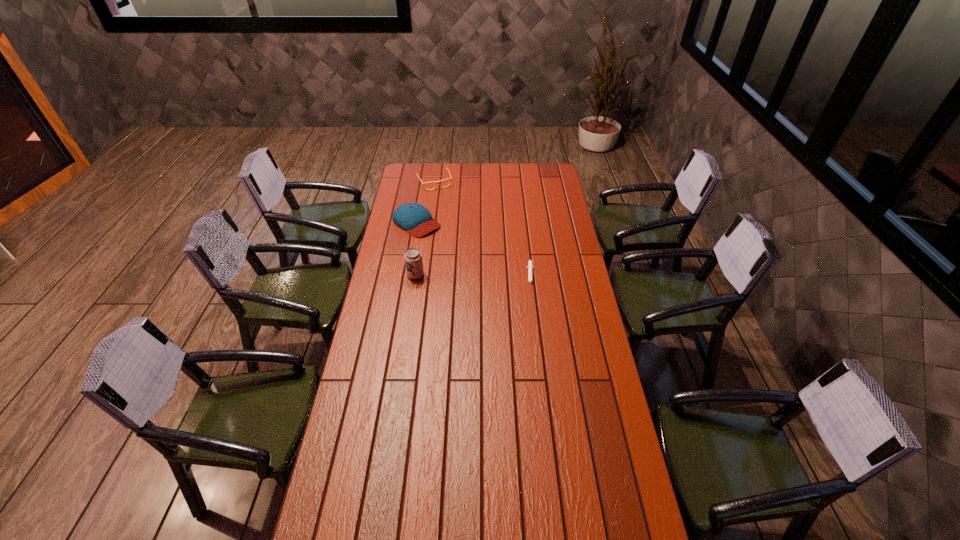
Find the location of a particular element. the tallest object is located at coordinates (413, 258).

Where is `the shortest object`? This screenshot has width=960, height=540. the shortest object is located at coordinates (530, 267).

The height and width of the screenshot is (540, 960). Find the location of `the rightmost object`. the rightmost object is located at coordinates (530, 267).

Where is `the farthest object`? the farthest object is located at coordinates (436, 182).

Find the location of a particular element. The image size is (960, 540). spectacles is located at coordinates (436, 182).

This screenshot has width=960, height=540. I want to click on baseball cap, so click(414, 218).

This screenshot has height=540, width=960. I want to click on the second farthest object, so click(414, 218).

Find the location of `free spot located 0.210m on the right of the beer can`. free spot located 0.210m on the right of the beer can is located at coordinates (470, 275).

Where is `vacant space positioned on the back of the shortest object`? vacant space positioned on the back of the shortest object is located at coordinates (526, 239).

I want to click on free region located in front of the lenses of the farthest object, so click(442, 197).